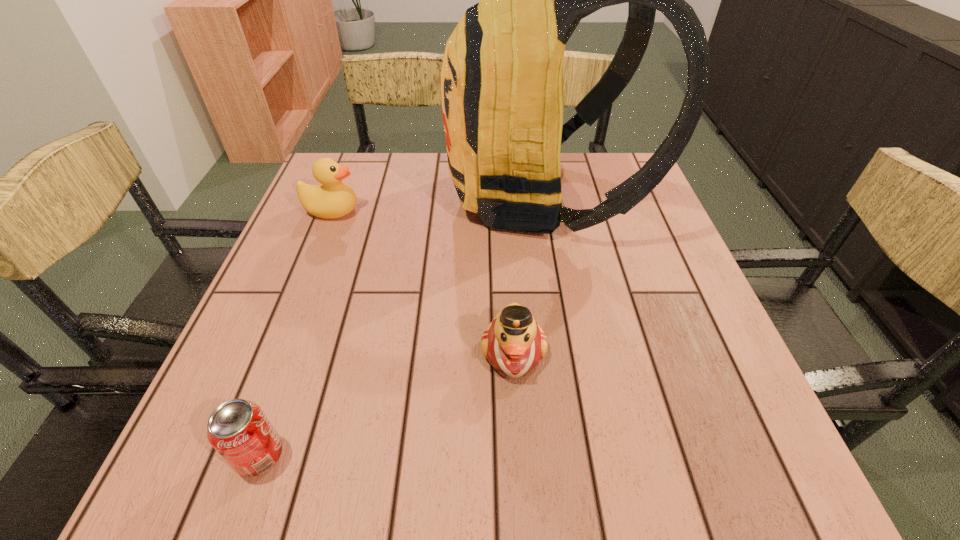
In the image, there is a desktop. Where is `vacant space at the far edge`? vacant space at the far edge is located at coordinates (411, 196).

You are a GUI agent. You are given a task and a screenshot of the screen. Output one action in this format:
    pyautogui.click(x=<x>, y=<y>)
    Task: Click on the free space at the near edge of the desktop
    The width and height of the screenshot is (960, 540).
    Given the screenshot: What is the action you would take?
    pyautogui.click(x=470, y=457)

Image resolution: width=960 pixels, height=540 pixels. In the image, there is a desktop. Find the location of `vacant region at the left edge`. vacant region at the left edge is located at coordinates (364, 210).

Identify the location of free space at the right edge. The image size is (960, 540). (636, 333).

Find the location of a particular element. Image resolution: width=960 pixels, height=540 pixels. vacant space at the near left corner of the desktop is located at coordinates (276, 492).

The image size is (960, 540). Identify the location of unoccupied area between the tallest object and the third farthest object. (527, 275).

You are a GUI agent. You are given a task and a screenshot of the screen. Output one action in this format:
    pyautogui.click(x=<x>, y=<y>)
    Task: Click on the free spot between the left duck and the backpack
    The image size is (960, 540).
    Given the screenshot: What is the action you would take?
    pyautogui.click(x=437, y=204)

Locate an element on the screen. vacant space that is in between the nearer duck and the nearest object is located at coordinates (387, 403).

Image resolution: width=960 pixels, height=540 pixels. I want to click on vacant area that lies between the nearest object and the left duck, so click(296, 333).

You are a GUI agent. You are given a task and a screenshot of the screen. Output one action in this format:
    pyautogui.click(x=<x>, y=<y>)
    Task: Click on the free spot between the tallest object and the nearer duck
    
    Given the screenshot: What is the action you would take?
    point(527,275)